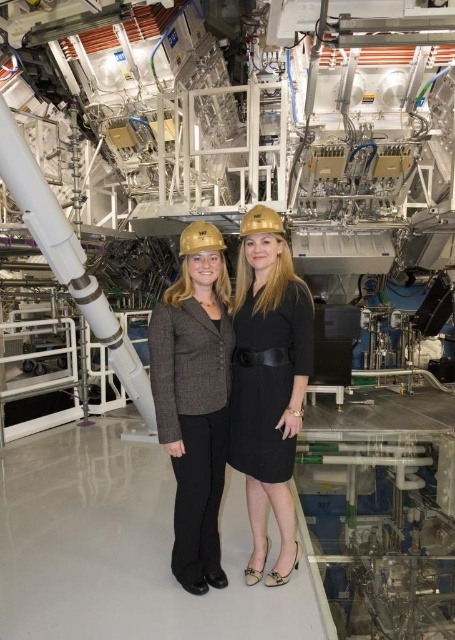
Question: Estimate the real-world distances between objects in this image. Which object is closer to the gray tweed blazer at center?

Choices:
 (A) gold hard hat at center
 (B) gold matte hard hat at center
 (C) black matte dress at center

Answer: (C)

Question: Which point is farther to the camera?

Choices:
 (A) (158, 432)
 (B) (241, 305)

Answer: (B)

Question: Estimate the real-world distances between objects in this image. Which object is closer to the gray tweed blazer at center?

Choices:
 (A) gold hard hat at center
 (B) gold matte hard hat at center
 (C) black matte dress at center

Answer: (C)

Question: Does gray tweed blazer at center have a smaller size compared to gold hard hat at center?

Choices:
 (A) no
 (B) yes

Answer: (A)

Question: Does black matte dress at center have a greater width compared to gold hard hat at center?

Choices:
 (A) yes
 (B) no

Answer: (A)

Question: Is black matte dress at center closer to camera compared to gold hard hat at center?

Choices:
 (A) no
 (B) yes

Answer: (B)